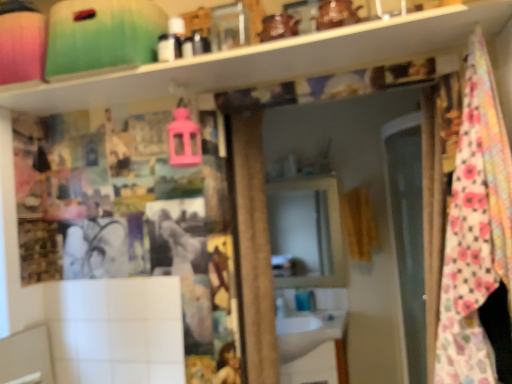
In order to face white glossy sink at center, should I rotate leftwards or rightwards?

To face it directly, rotate right by 7.900 degrees.

This screenshot has height=384, width=512. What do you see at coordinates (304, 327) in the screenshot?
I see `white glossy sink at center` at bounding box center [304, 327].

Find the location of a particular element. This screenshot has height=384, width=512. floral cotton blanket at right is located at coordinates (475, 227).

Describe the element at coordinates (359, 223) in the screenshot. The height and width of the screenshot is (384, 512). I see `yellow fabric curtain at right` at that location.

Image resolution: width=512 pixels, height=384 pixels. I want to click on white glossy sink at center, so click(x=304, y=327).

How many degrees apart are the facing directions of blue glossy faucet at lower center and white glossy sink at center?

The angular difference between blue glossy faucet at lower center and white glossy sink at center is 0.845 degrees.

Is blue glossy faucet at lower center at the left side of white glossy sink at center?

No.

From a real-world perspective, is blue glossy faucet at lower center positioned above or below white glossy sink at center?

From a real-world perspective, blue glossy faucet at lower center is physically above white glossy sink at center.

Would you say matte black toiletries at upper center is outside yellow fabric curtain at right?

Yes.

In the scene shown: Considering the relative sizes of matte black toiletries at upper center and yellow fabric curtain at right in the image provided, is matte black toiletries at upper center smaller than yellow fabric curtain at right?

Correct, matte black toiletries at upper center occupies less space than yellow fabric curtain at right.

Consider the image. Which object is wider, matte black toiletries at upper center or yellow fabric curtain at right?

yellow fabric curtain at right.

Does point (312, 304) lie in front of point (367, 192)?

That is False.

In the scene shown: Is blue glossy faucet at lower center in front of yellow fabric curtain at right?

No, it is not.

What's the angular difference between blue glossy faucet at lower center and yellow fabric curtain at right's facing directions?

4.95 degrees.

From a real-world perspective, is floral cotton blanket at right physically located above or below matte black toiletries at upper center?

floral cotton blanket at right is situated lower than matte black toiletries at upper center in the real world.

The width and height of the screenshot is (512, 384). I want to click on blanket lying below the matte black toiletries at upper center (from the image's perspective), so click(x=475, y=227).

From their relative heights in the image, would you say floral cotton blanket at right is taller or shorter than matte black toiletries at upper center?

Considering their sizes, floral cotton blanket at right has more height than matte black toiletries at upper center.

Does point (278, 302) lie in front of point (448, 264)?

That is False.

How distant is white glossy sink at center from floral cotton blanket at right?

white glossy sink at center is 5.20 feet from floral cotton blanket at right.

In the image, there is a floral cotton blanket at right. Where is `sink below it (from the image's perspective)`? This screenshot has height=384, width=512. sink below it (from the image's perspective) is located at coordinates (304, 327).

Would you consider white glossy sink at center to be distant from floral cotton blanket at right?

Yes.

In terms of width, does blue glossy faucet at lower center look wider or thinner when compared to floral cotton blanket at right?

Clearly, blue glossy faucet at lower center has less width compared to floral cotton blanket at right.

Is blue glossy faucet at lower center facing towards floral cotton blanket at right?

No.

Locate an element on the screen. The image size is (512, 384). faucet on the left of floral cotton blanket at right is located at coordinates (311, 301).

Is matte black toiletries at upper center beside blue glossy faucet at lower center?

No, matte black toiletries at upper center is not beside blue glossy faucet at lower center.

Is matte black toiletries at upper center not inside blue glossy faucet at lower center?

Yes, matte black toiletries at upper center is outside of blue glossy faucet at lower center.

How different are the orientations of matte black toiletries at upper center and blue glossy faucet at lower center in degrees?

They differ by 3.63 degrees in their facing directions.

Does matte black toiletries at upper center turn towards blue glossy faucet at lower center?

No, matte black toiletries at upper center is not aimed at blue glossy faucet at lower center.

What are the coordinates of `faucet located behind the white glossy sink at center` in the screenshot? It's located at (311, 301).

I want to click on toiletry on the left of the yellow fabric curtain at right, so click(180, 42).

When comparing their distances from matte black toiletries at upper center, does blue glossy faucet at lower center or yellow fabric curtain at right seem closer?

yellow fabric curtain at right is positioned closer to the anchor matte black toiletries at upper center.

Estimate the real-world distances between objects in this image. Which object is further from yellow fabric curtain at right, blue glossy faucet at lower center or matte black toiletries at upper center?

matte black toiletries at upper center.

From the image, which object appears to be nearer to white glossy sink at center, yellow fabric curtain at right or matte black toiletries at upper center?

yellow fabric curtain at right lies closer to white glossy sink at center than the other object.

Consider the image. Which object lies nearer to the anchor point white glossy sink at center, yellow fabric curtain at right or blue glossy faucet at lower center?

Among the two, blue glossy faucet at lower center is located nearer to white glossy sink at center.

Based on their spatial positions, is yellow fabric curtain at right or blue glossy faucet at lower center closer to matte black toiletries at upper center?

The object closer to matte black toiletries at upper center is yellow fabric curtain at right.

Looking at the image, which one is located closer to floral cotton blanket at right, white glossy sink at center or yellow fabric curtain at right?

Among the two, yellow fabric curtain at right is located nearer to floral cotton blanket at right.

Which object lies nearer to the anchor point white glossy sink at center, matte black toiletries at upper center or yellow fabric curtain at right?

yellow fabric curtain at right lies closer to white glossy sink at center than the other object.

Which object lies further to the anchor point yellow fabric curtain at right, white glossy sink at center or blue glossy faucet at lower center?

blue glossy faucet at lower center.

Find the location of a particular element. sink positioned between matte black toiletries at upper center and blue glossy faucet at lower center from near to far is located at coordinates (304, 327).

Where is `sink between floral cotton blanket at right and blue glossy faucet at lower center along the z-axis`? This screenshot has height=384, width=512. sink between floral cotton blanket at right and blue glossy faucet at lower center along the z-axis is located at coordinates (304, 327).

Locate an element on the screen. This screenshot has height=384, width=512. curtain between floral cotton blanket at right and blue glossy faucet at lower center in the front-back direction is located at coordinates (359, 223).

I want to click on toiletry located between floral cotton blanket at right and white glossy sink at center in the depth direction, so click(x=180, y=42).